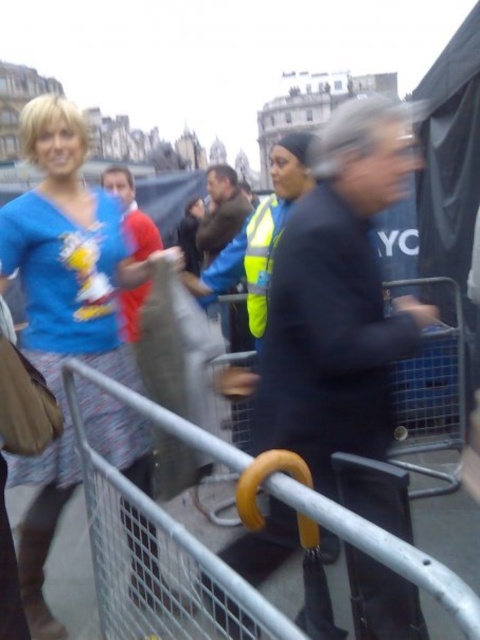
Question: Can you confirm if black matte jacket at center is positioned to the left of brown leather jacket at center?

Choices:
 (A) yes
 (B) no

Answer: (B)

Question: Which object is the closest to the red shirt at center?

Choices:
 (A) black matte jacket at center
 (B) matte blue shirt at upper left
 (C) brown leather jacket at center

Answer: (B)

Question: Among these points, which one is nearest to the camera?

Choices:
 (A) (111, 180)
 (B) (355, 109)

Answer: (B)

Question: Is brown leather jacket at center to the right of red shirt at center from the viewer's perspective?

Choices:
 (A) no
 (B) yes

Answer: (B)

Question: Which point appears farthest from the camera in this image?

Choices:
 (A) (93, 419)
 (B) (389, 589)
 (C) (156, 234)

Answer: (C)

Question: Is the position of matte blue shirt at upper left more distant than that of brown leather jacket at center?

Choices:
 (A) yes
 (B) no

Answer: (B)